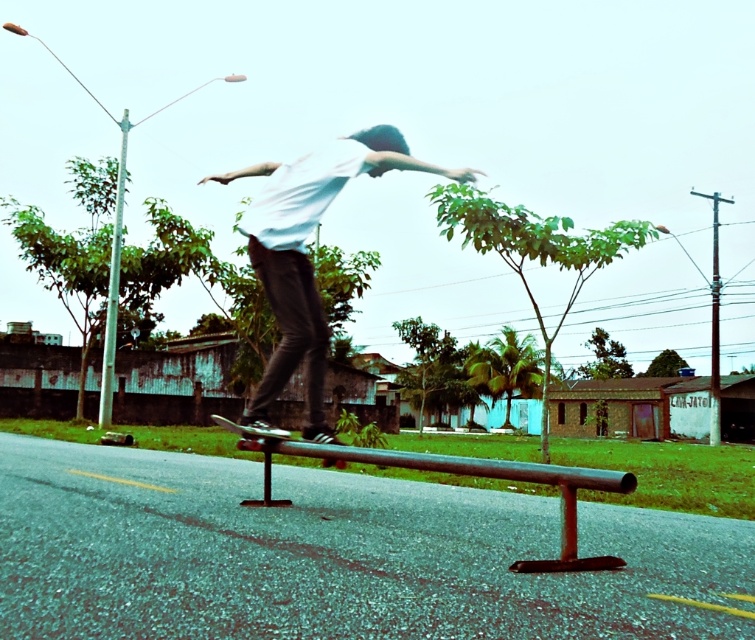
You are standing at the camera position and want to throw a small beanbag to the white matte skateboarder at center. The beanbag can travel up to 6 meters. Do you think you can reach them?

The white matte skateboarder at center is 5.62 meters away from the camera, so yes, the beanbag can reach them since the distance is within the 6 meters range.

You are a photographer aiming to capture the skateboarder and the rusty metal rail at center. Since the metallic silver skateboard at center is also in the frame, will the skateboard be in focus if you focus on the rail?

The rusty metal rail at center is in front of the metallic silver skateboard at center. If you focus on the rail, the skateboard might be slightly out of focus depending on the camera lens depth of field.